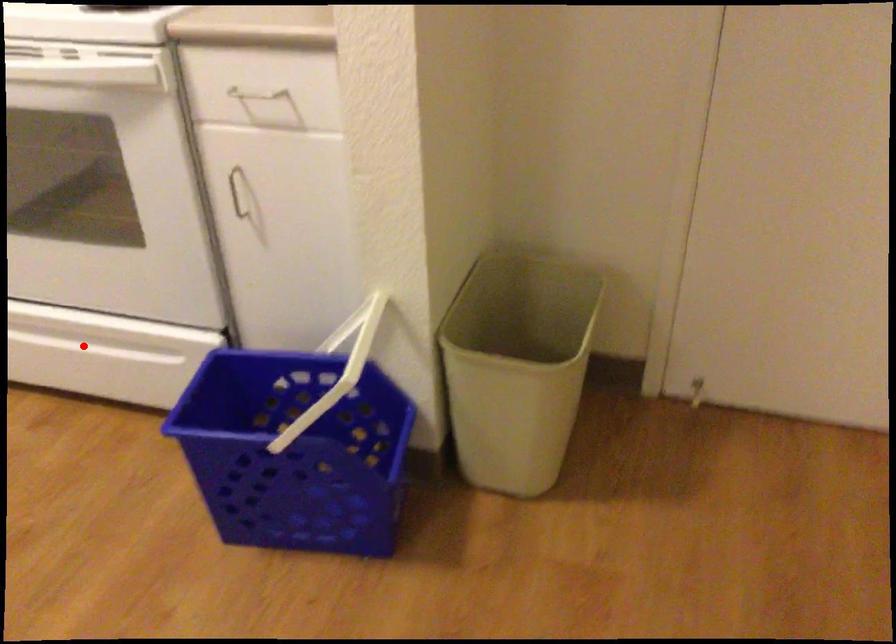
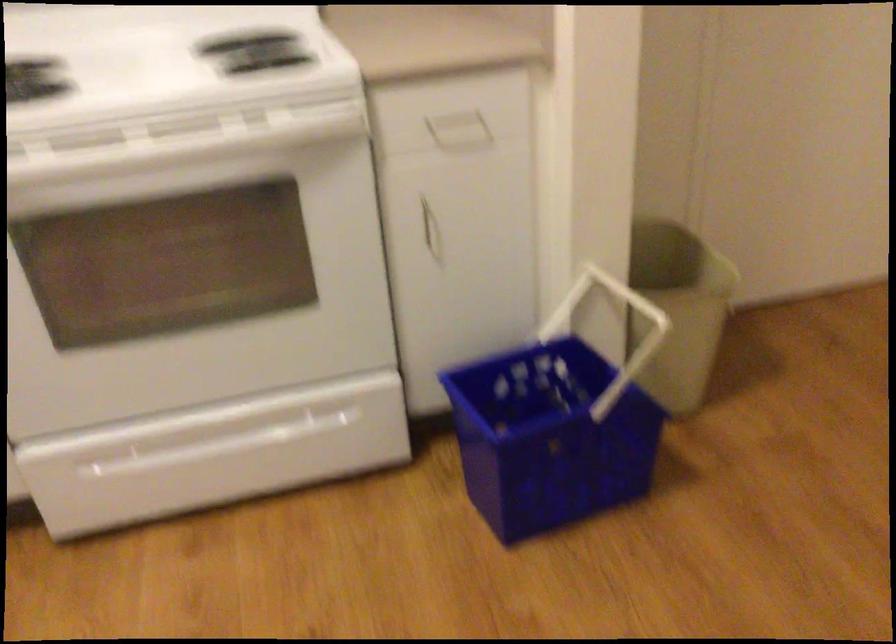
Question: I am providing you with two images of the same scene from different viewpoints. A red point is marked on the first image. Is the red point's position out of view in image 2?

Choices:
 (A) Yes
 (B) No

Answer: (B)